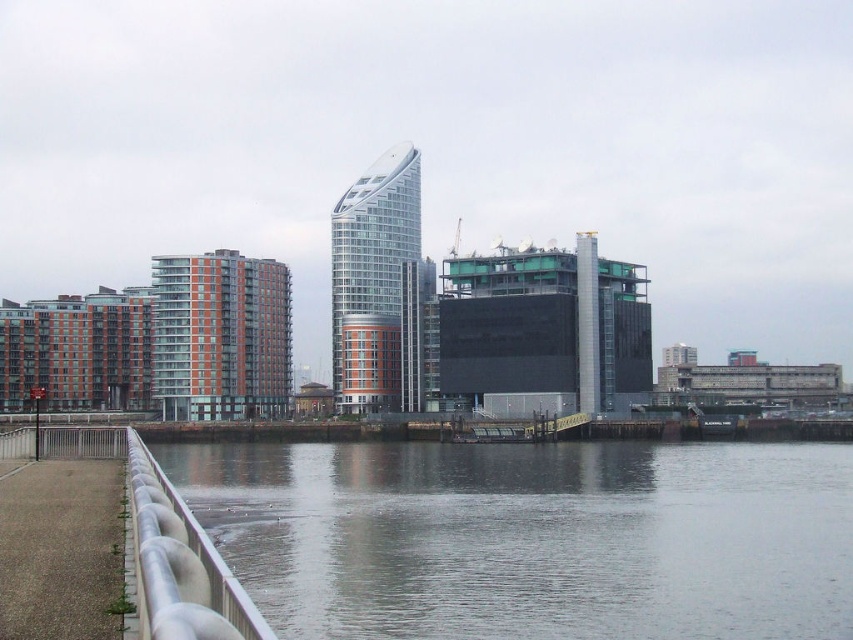
You are standing on the walkway and want to take a photo of the smooth gray water at lower center without the white glossy rail at lower left appearing in the background. Is this possible based on their positions?

The white glossy rail at lower left is behind the smooth gray water at lower center, so you can take a photo of the smooth gray water at lower center without the rail appearing in the background since the rail is positioned behind it.

You are a photographer planning to capture a wide shot of the waterfront scene. You notice the smooth gray water at lower center and the white glossy rail at lower left. Which of these two objects will occupy more space in your photo?

The smooth gray water at lower center will occupy more space in the photo because it is bigger than the white glossy rail at lower left according to the description.

Based on the photo, you are standing at the center of the walkway and want to reach the smooth gray water at lower center. According to the coordinates, where should you head towards?

The smooth gray water at lower center is located at coordinates point [531,538], so you should head towards that direction to reach it.